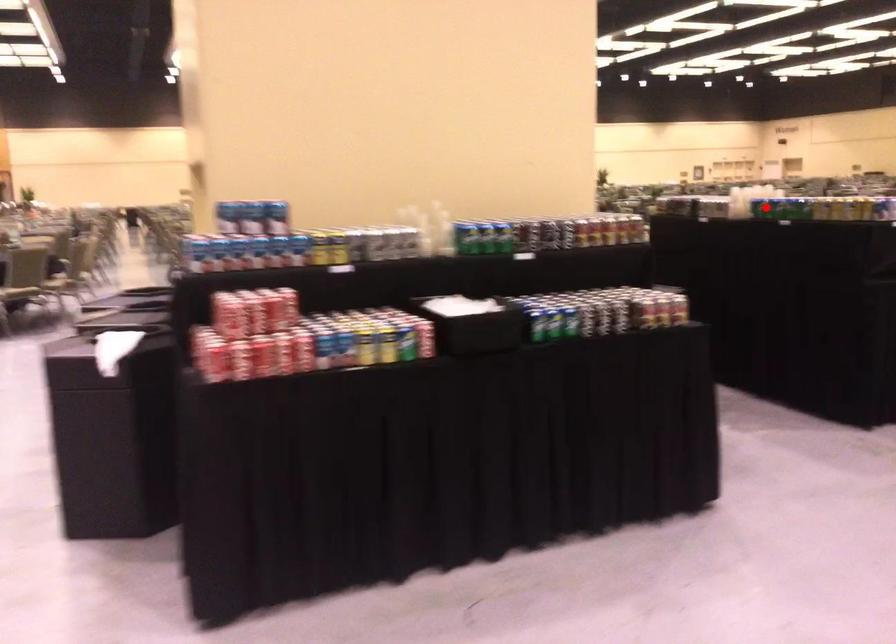
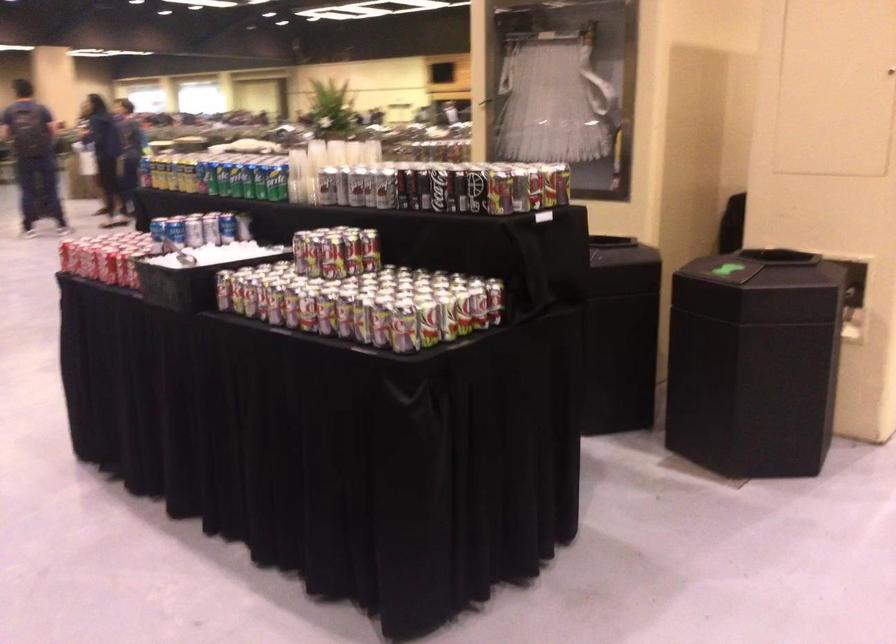
Question: I am providing you with two images of the same scene from different viewpoints. A red point is marked on the first image. At the location where the point appears in image 1, is it still visible in image 2?

Choices:
 (A) Yes
 (B) No

Answer: (B)